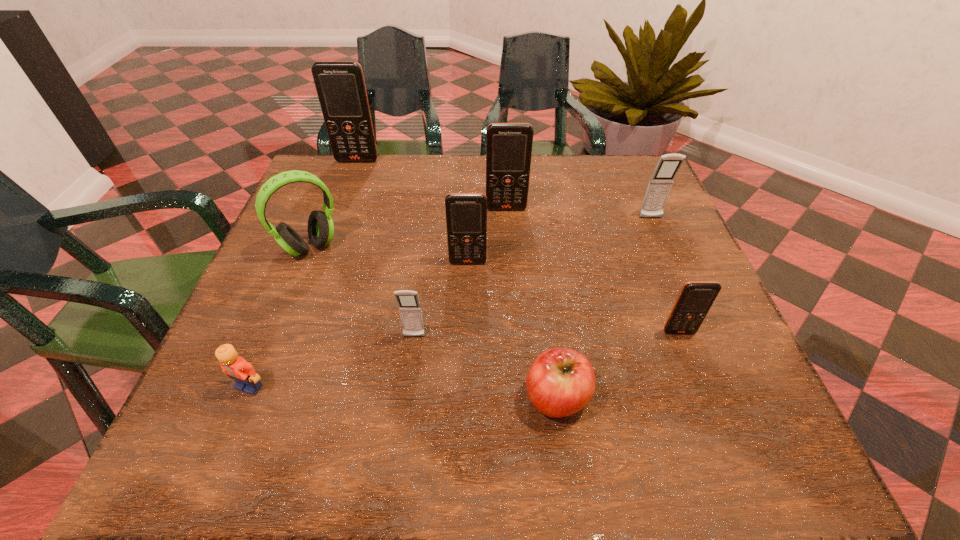
Identify the location of the farthest object. (340, 85).

Locate an element on the screen. The width and height of the screenshot is (960, 540). the tallest object is located at coordinates (340, 85).

What are the coordinates of `the second farthest object` in the screenshot? It's located at (508, 145).

I want to click on the second farthest orange cellular telephone, so click(x=508, y=145).

I want to click on headset, so click(x=320, y=225).

Where is `the farther gray cellular telephone`? This screenshot has width=960, height=540. the farther gray cellular telephone is located at coordinates (659, 186).

Locate an element on the screen. the seventh nearest object is located at coordinates (659, 186).

Where is `the fourth farthest cellular telephone`? This screenshot has width=960, height=540. the fourth farthest cellular telephone is located at coordinates (466, 213).

Identify the location of the second nearest orange cellular telephone. (466, 213).

At what (x,y) coordinates should I click in order to perform the action: click on the rightmost orange cellular telephone. Please return your answer as a coordinate pair (x, y). The image size is (960, 540). Looking at the image, I should click on tap(695, 299).